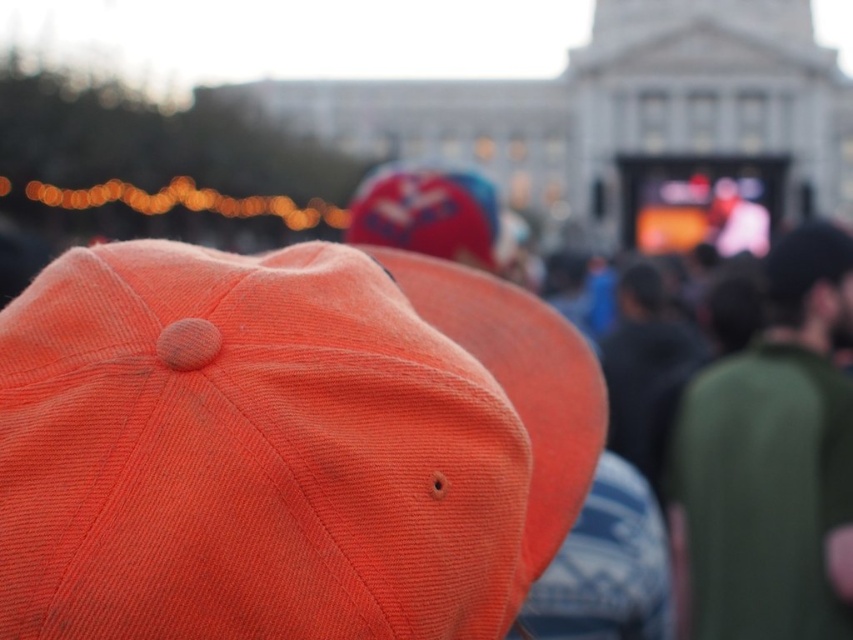
Can you confirm if orange corduroy baseball cap at center is positioned to the left of green cotton shirt at right?

Correct, you'll find orange corduroy baseball cap at center to the left of green cotton shirt at right.

Who is more forward, (532, 420) or (780, 614)?

Point (532, 420) is in front.

Where is `orange corduroy baseball cap at center`? orange corduroy baseball cap at center is located at coordinates (282, 445).